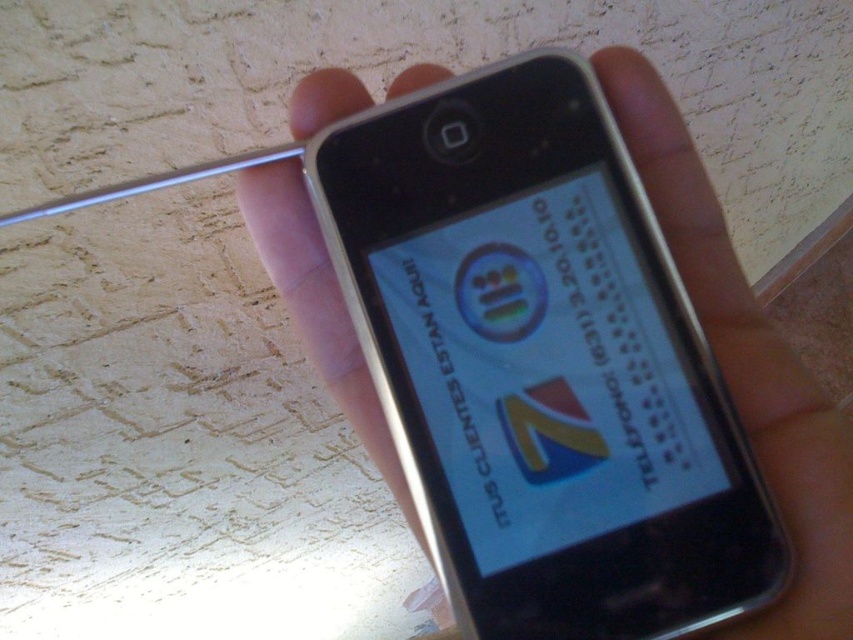
You are designing a phone case that needs to fit both the silver metallic phone at center and the white glossy logo at center without overlapping. What is the minimum width the case should have?

The minimum width of the case should be at least 4.27 inches to accommodate the distance between the silver metallic phone at center and the white glossy logo at center without overlapping.

You are looking at a smartphone screen and see both the white glossy text at center and the white glossy logo at center. Which one is covering the other?

The white glossy text at center is positioned over white glossy logo at center, so it is covering the logo.